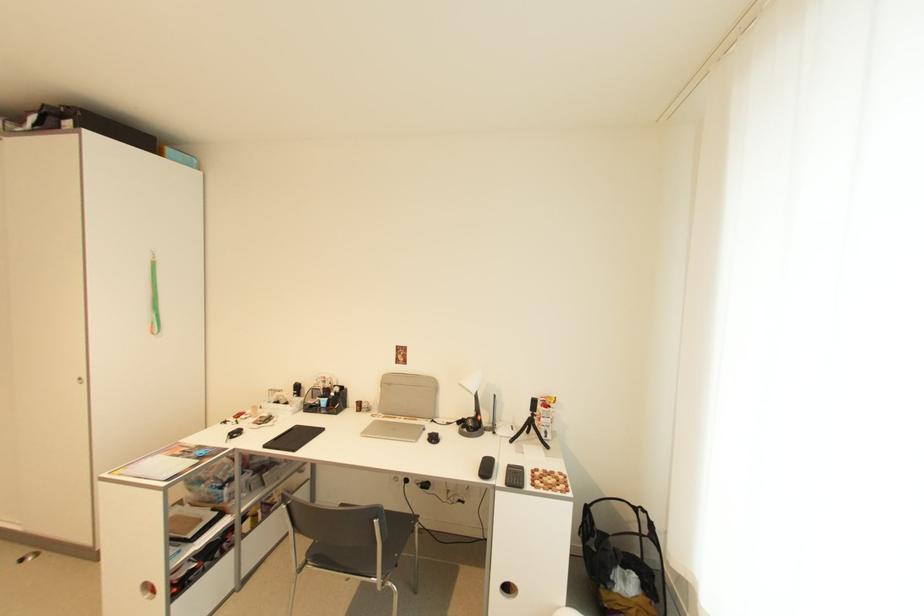
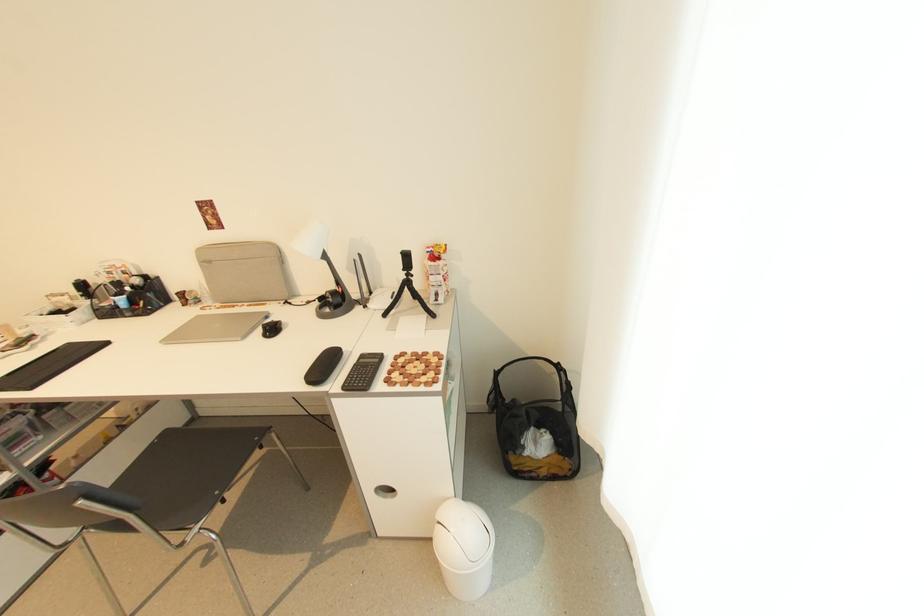
Question: How did the camera likely rotate?

Choices:
 (A) Left
 (B) Right
 (C) Up
 (D) Down

Answer: (D)